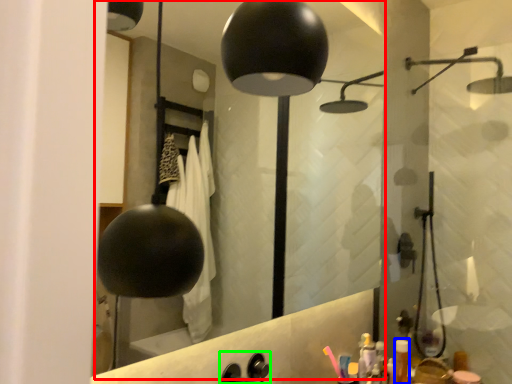
Question: Which is farther away from mirror (highlighted by a red box)? toiletry (highlighted by a blue box) or faucet (highlighted by a green box)?

Choices:
 (A) toiletry
 (B) faucet

Answer: (B)